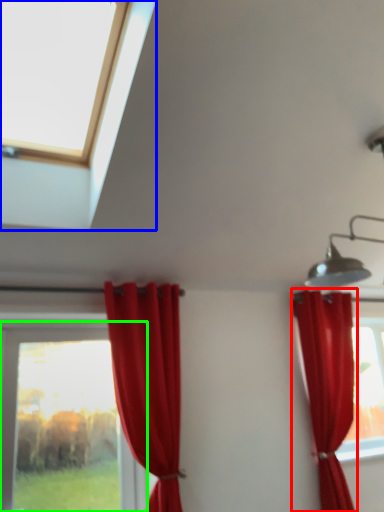
Question: Which object is positioned closest to curtain (highlighted by a red box)? Select from window (highlighted by a blue box) and window (highlighted by a green box).

Choices:
 (A) window
 (B) window

Answer: (A)